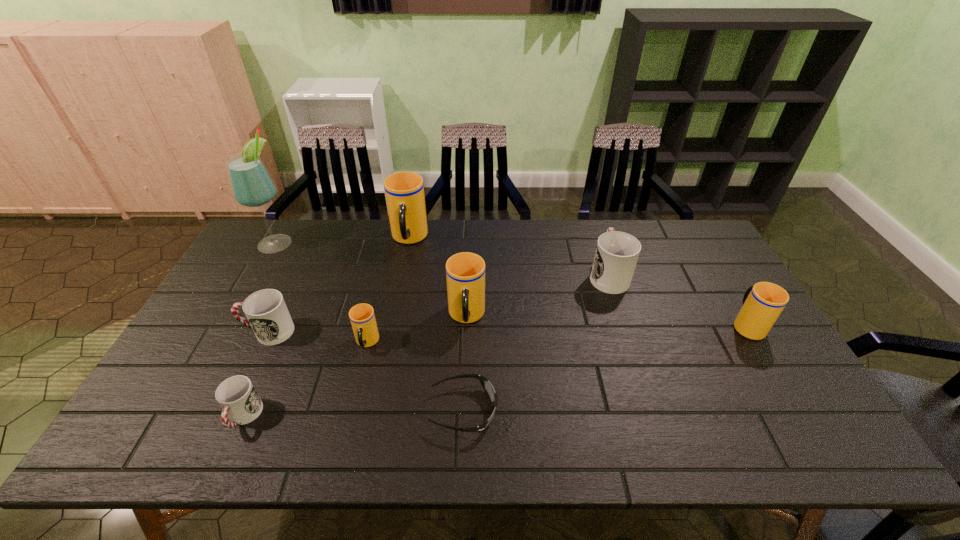
Find the location of a particular element. The height and width of the screenshot is (540, 960). the smallest beige cup is located at coordinates (x=362, y=317).

You are a GUI agent. You are given a task and a screenshot of the screen. Output one action in this format:
    pyautogui.click(x=<x>, y=<y>)
    Task: Click on the nearest cup
    
    Given the screenshot: What is the action you would take?
    pyautogui.click(x=237, y=396)

You are a GUI agent. You are given a task and a screenshot of the screen. Output one action in this format:
    pyautogui.click(x=<x>, y=<y>)
    Task: Click on the smallest red cup
    This screenshot has width=960, height=540.
    Given the screenshot: What is the action you would take?
    pyautogui.click(x=237, y=396)

Find the location of a particular element. sunglasses is located at coordinates (487, 386).

Where is `free space located on the front of the alcohol`? free space located on the front of the alcohol is located at coordinates (232, 322).

Locate an element on the screen. free space located 0.050m on the side of the biggest beige cup with the handle is located at coordinates (404, 265).

Where is `free space located on the side of the third tallest object with the handle`? Image resolution: width=960 pixels, height=540 pixels. free space located on the side of the third tallest object with the handle is located at coordinates (465, 373).

In order to click on vacant area located on the side of the sixth nearest cup where the handle is located in this screenshot , I will do `click(595, 235)`.

Identify the location of vacant space situated on the side of the sixth nearest cup where the handle is located. (592, 226).

The image size is (960, 540). I want to click on vacant space located on the side of the sixth nearest cup where the handle is located, so click(x=594, y=231).